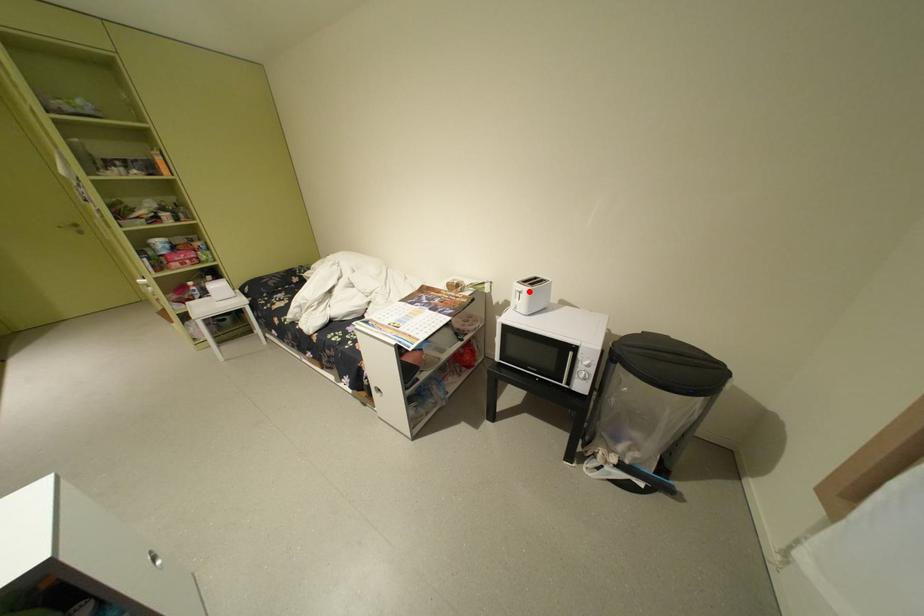
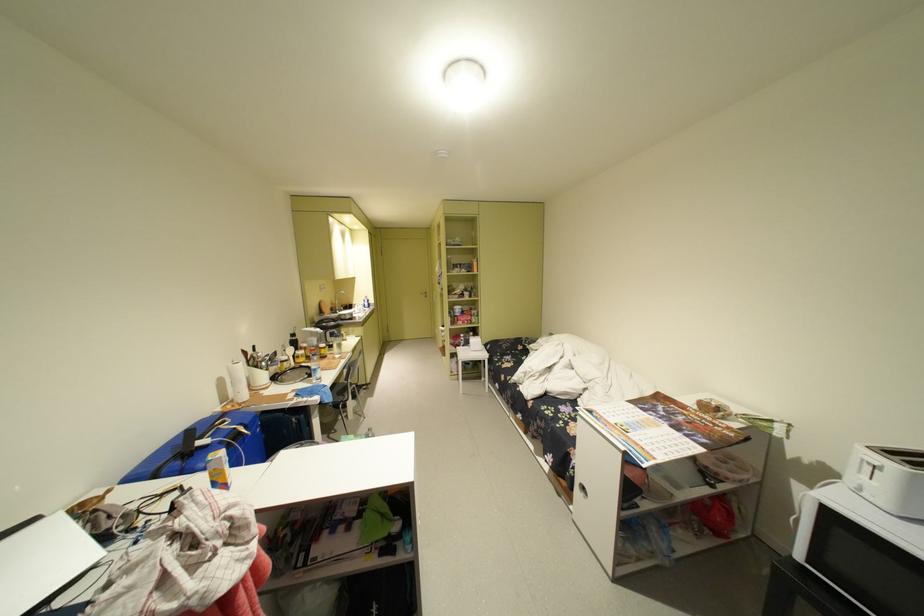
The point at the highlighted location is marked in the first image. Where is the corresponding point in the second image?

(881, 464)